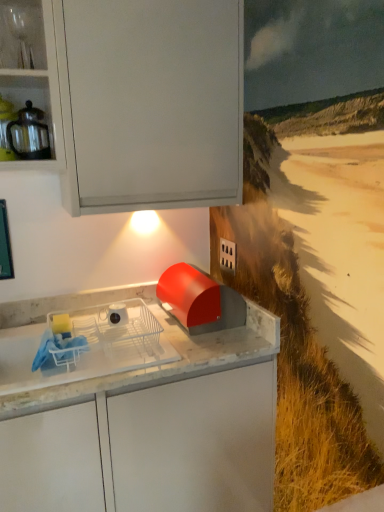
Measure the distance between clear glassware at upper left and camera.

The depth of clear glassware at upper left is 1.49 meters.

Describe the element at coordinates (84, 348) in the screenshot. This screenshot has width=384, height=512. I see `white plastic dish rack at center` at that location.

Locate an element on the screen. This screenshot has height=512, width=384. white glossy mug at center is located at coordinates (117, 314).

The image size is (384, 512). In the image, there is a white plastic dish rack at center. In order to click on appliance above it (from the image's perspective) in this screenshot , I will do `click(117, 314)`.

From a real-world perspective, is white plastic dish rack at center positioned under white glossy mug at center based on gravity?

Indeed, from a real-world perspective, white plastic dish rack at center is positioned beneath white glossy mug at center.

How much distance is there between white plastic dish rack at center and white glossy mug at center?

white plastic dish rack at center and white glossy mug at center are 8.14 inches apart.

From the image's perspective, is white plastic dish rack at center under white glossy mug at center?

Correct, white plastic dish rack at center appears lower than white glossy mug at center in the image.

Based on their sizes in the image, would you say matte glass teapot at upper left is bigger or smaller than clear glassware at upper left?

matte glass teapot at upper left is bigger than clear glassware at upper left.

Which is more to the left, matte glass teapot at upper left or clear glassware at upper left?

clear glassware at upper left is more to the left.

From the picture: Which point is more forward, (19, 139) or (0, 31)?

The point (19, 139) is closer to the camera.

Does matte glass teapot at upper left contain clear glassware at upper left?

That's incorrect, clear glassware at upper left is not inside matte glass teapot at upper left.

How distant is matte glass teapot at upper left from white glossy mug at center?

matte glass teapot at upper left and white glossy mug at center are 27.19 inches apart.

Would you say matte glass teapot at upper left is a long distance from white glossy mug at center?

No, matte glass teapot at upper left is not far away from white glossy mug at center.

Considering the relative positions of matte glass teapot at upper left and white glossy mug at center in the image provided, is matte glass teapot at upper left to the left of white glossy mug at center from the viewer's perspective?

Indeed, matte glass teapot at upper left is positioned on the left side of white glossy mug at center.

This screenshot has width=384, height=512. Find the location of `kitchen appliance in front of the white glossy mug at center`. kitchen appliance in front of the white glossy mug at center is located at coordinates pos(29,134).

Which is correct: white plastic dish rack at center is inside matte glass teapot at upper left, or outside of it?

white plastic dish rack at center is not inside matte glass teapot at upper left, it's outside.

From the image's perspective, between white plastic dish rack at center and matte glass teapot at upper left, who is located below?

From the image's view, white plastic dish rack at center is below.

Between white plastic dish rack at center and matte glass teapot at upper left, which one has more height?

matte glass teapot at upper left is taller.

From a real-world perspective, between white plastic dish rack at center and matte glass teapot at upper left, who is vertically higher?

matte glass teapot at upper left is physically above.

Considering the sizes of objects clear glassware at upper left and white plastic dish rack at center in the image provided, who is wider, clear glassware at upper left or white plastic dish rack at center?

white plastic dish rack at center.

Is clear glassware at upper left positioned far away from white plastic dish rack at center?

Yes, clear glassware at upper left and white plastic dish rack at center are located far from each other.

From a real-world perspective, is clear glassware at upper left above or below white plastic dish rack at center?

From a real-world perspective, clear glassware at upper left is physically above white plastic dish rack at center.

From a real-world perspective, is white glossy mug at center positioned under white plastic dish rack at center based on gravity?

Incorrect, from a real-world perspective, white glossy mug at center is higher than white plastic dish rack at center.

Considering the positions of objects white glossy mug at center and white plastic dish rack at center in the image provided, who is more to the left, white glossy mug at center or white plastic dish rack at center?

white plastic dish rack at center is more to the left.

Considering the sizes of objects white glossy mug at center and white plastic dish rack at center in the image provided, who is wider, white glossy mug at center or white plastic dish rack at center?

white plastic dish rack at center.

From the image's perspective, does white glossy mug at center appear higher than white plastic dish rack at center?

Indeed, from the image's perspective, white glossy mug at center is shown above white plastic dish rack at center.

Which of these two, matte glass teapot at upper left or white plastic dish rack at center, is wider?

With larger width is white plastic dish rack at center.

Is matte glass teapot at upper left directly adjacent to white plastic dish rack at center?

No, matte glass teapot at upper left is not next to white plastic dish rack at center.

Locate an element on the screen. The image size is (384, 512). home appliance on the right of matte glass teapot at upper left is located at coordinates (84, 348).

Is point (30, 106) farther from viewer compared to point (168, 342)?

Yes, point (30, 106) is farther from viewer.

This screenshot has height=512, width=384. I want to click on home appliance in front of the white glossy mug at center, so click(84, 348).

Find the location of a particular element. The width and height of the screenshot is (384, 512). shelf located above the matte glass teapot at upper left (from the image's perspective) is located at coordinates (22, 35).

Estimate the real-world distances between objects in this image. Which object is further from clear glassware at upper left, white glossy mug at center or matte glass teapot at upper left?

white glossy mug at center is further to clear glassware at upper left.

When comparing their distances from matte glass teapot at upper left, does clear glassware at upper left or white plastic dish rack at center seem closer?

clear glassware at upper left.

Based on their spatial positions, is clear glassware at upper left or white glossy mug at center closer to white plastic dish rack at center?

white glossy mug at center is closer to white plastic dish rack at center.

From the image, which object appears to be nearer to matte glass teapot at upper left, white glossy mug at center or white plastic dish rack at center?

white glossy mug at center.

Based on their spatial positions, is white glossy mug at center or white plastic dish rack at center further from clear glassware at upper left?

white plastic dish rack at center is further to clear glassware at upper left.

Looking at the image, which one is located further to matte glass teapot at upper left, clear glassware at upper left or white glossy mug at center?

Among the two, white glossy mug at center is located further to matte glass teapot at upper left.

Based on their spatial positions, is white plastic dish rack at center or clear glassware at upper left further from white glossy mug at center?

clear glassware at upper left.

Based on their spatial positions, is clear glassware at upper left or white plastic dish rack at center further from white glossy mug at center?

clear glassware at upper left lies further to white glossy mug at center than the other object.

Image resolution: width=384 pixels, height=512 pixels. Find the location of `appliance between matte glass teapot at upper left and white plastic dish rack at center in the up-down direction`. appliance between matte glass teapot at upper left and white plastic dish rack at center in the up-down direction is located at coordinates (117, 314).

At what (x,y) coordinates should I click in order to perform the action: click on appliance that lies between clear glassware at upper left and white plastic dish rack at center from top to bottom. Please return your answer as a coordinate pair (x, y). This screenshot has width=384, height=512. Looking at the image, I should click on [x=117, y=314].

At what (x,y) coordinates should I click in order to perform the action: click on kitchen appliance between clear glassware at upper left and white glossy mug at center in the up-down direction. Please return your answer as a coordinate pair (x, y). Image resolution: width=384 pixels, height=512 pixels. Looking at the image, I should click on (29, 134).

I want to click on kitchen appliance between clear glassware at upper left and white plastic dish rack at center in the up-down direction, so click(29, 134).